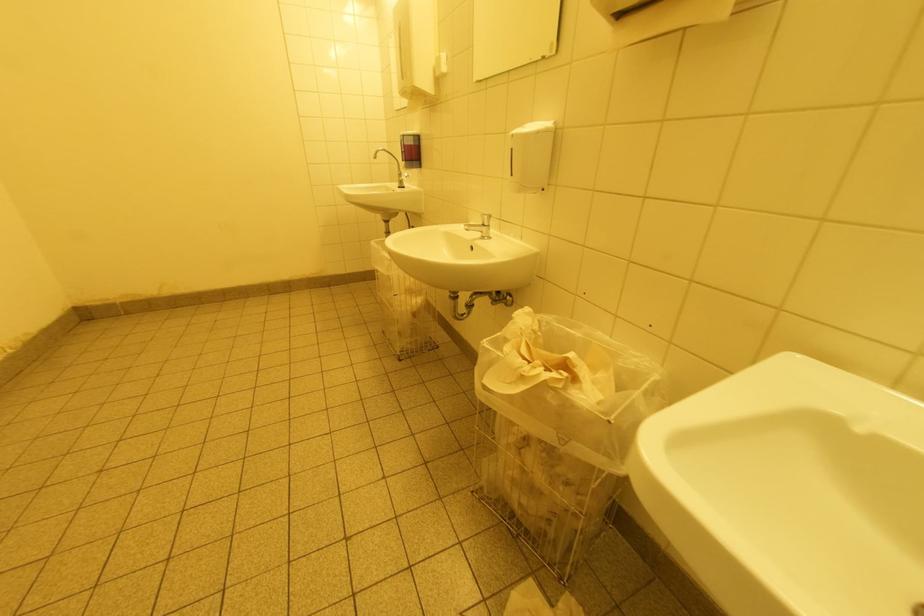
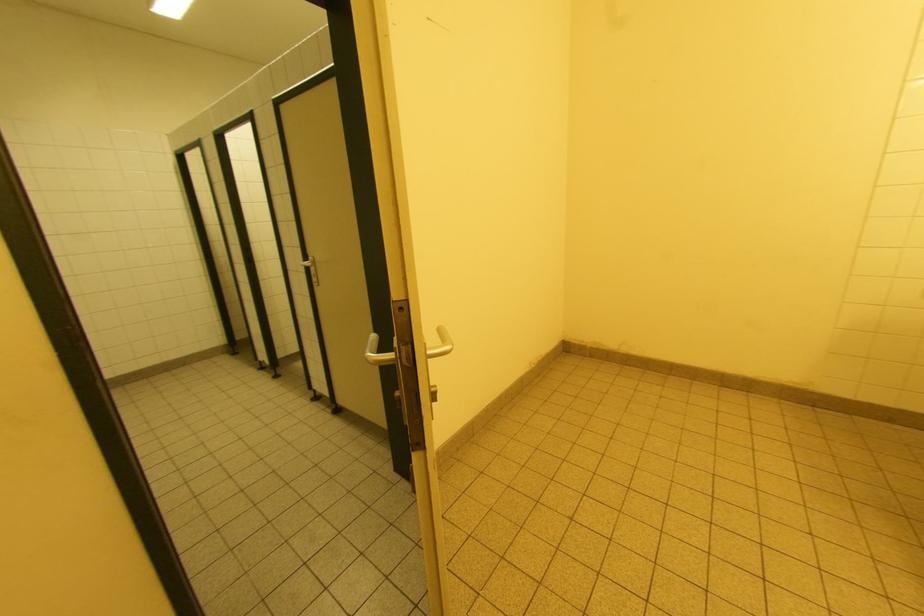
Question: Based on the continuous images, in which direction is the camera rotating? Reply with the corresponding letter.

Choices:
 (A) Left
 (B) Right
 (C) Up
 (D) Down

Answer: (A)